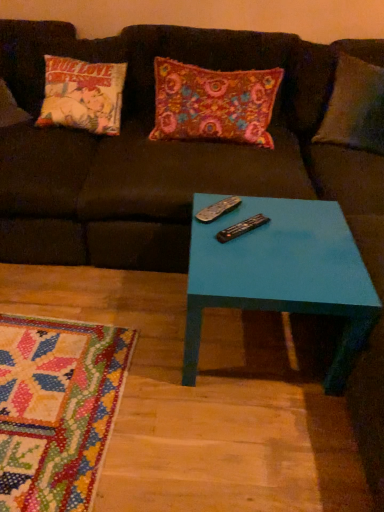
This screenshot has width=384, height=512. What do you see at coordinates (218, 209) in the screenshot?
I see `black plastic remote at center, arranged as the 1th remote when viewed from the back` at bounding box center [218, 209].

This screenshot has width=384, height=512. What are the coordinates of `teal glossy table at center` in the screenshot? It's located at (280, 273).

From a real-world perspective, is teal glossy table at center located beneath black plastic remote at center, which is counted as the 2th remote, starting from the front?

Correct, in the physical world, teal glossy table at center is lower than black plastic remote at center, which is counted as the 2th remote, starting from the front.

Between teal glossy table at center and black plastic remote at center, which is counted as the 2th remote, starting from the front, which one has smaller width?

Thinner between the two is black plastic remote at center, which is counted as the 2th remote, starting from the front.

Does point (279, 216) appear closer or farther from the camera than point (209, 221)?

Point (279, 216) is positioned farther from the camera compared to point (209, 221).

The width and height of the screenshot is (384, 512). In order to click on coffee table that appears below the black plastic remote at center, which is counted as the 2th remote, starting from the front (from a real-world perspective) in this screenshot , I will do tap(280, 273).

Is black plastic remote at center, which is the first remote in front-to-back order, to the right of teal glossy table at center from the viewer's perspective?

No, black plastic remote at center, which is the first remote in front-to-back order, is not to the right of teal glossy table at center.

Is black plastic remote at center, which is the first remote in front-to-back order, wider than teal glossy table at center?

No.

Considering the sizes of black plastic remote at center, the 2th remote in the back-to-front sequence, and teal glossy table at center in the image, is black plastic remote at center, the 2th remote in the back-to-front sequence, taller or shorter than teal glossy table at center?

In the image, black plastic remote at center, the 2th remote in the back-to-front sequence, appears to be shorter than teal glossy table at center.

How different are the orientations of black plastic remote at center, which is the first remote in front-to-back order, and teal glossy table at center in degrees?

There is a 51.2-degree angle between the facing directions of black plastic remote at center, which is the first remote in front-to-back order, and teal glossy table at center.

Between black plastic remote at center, arranged as the 1th remote when viewed from the back, and floral fabric pillow at center, which one is positioned in front?

black plastic remote at center, arranged as the 1th remote when viewed from the back, is closer to the camera.

Does black plastic remote at center, arranged as the 1th remote when viewed from the back, have a smaller size compared to floral fabric pillow at center?

Yes.

Is black plastic remote at center, arranged as the 1th remote when viewed from the back, positioned beyond the bounds of floral fabric pillow at center?

Yes, black plastic remote at center, arranged as the 1th remote when viewed from the back, is located beyond the bounds of floral fabric pillow at center.

From a real-world perspective, who is located lower, teal glossy table at center or floral fabric pillow at center?

teal glossy table at center, from a real-world perspective.

Image resolution: width=384 pixels, height=512 pixels. What are the coordinates of `pillow located on the left of teal glossy table at center` in the screenshot? It's located at (213, 103).

Is teal glossy table at center positioned with its back to floral fabric pillow at center?

Yes.

Can you confirm if teal glossy table at center is wider than floral fabric pillow at center?

Yes.

Is black plastic remote at center, the 2th remote in the back-to-front sequence, with black plastic remote at center, arranged as the 1th remote when viewed from the back?

No.

Would you say black plastic remote at center, the 2th remote in the back-to-front sequence, is outside black plastic remote at center, which is counted as the 2th remote, starting from the front?

Yes, black plastic remote at center, the 2th remote in the back-to-front sequence, is located beyond the bounds of black plastic remote at center, which is counted as the 2th remote, starting from the front.

Looking at the image, does black plastic remote at center, which is the first remote in front-to-back order, seem bigger or smaller compared to black plastic remote at center, which is counted as the 2th remote, starting from the front?

black plastic remote at center, which is the first remote in front-to-back order, is smaller than black plastic remote at center, which is counted as the 2th remote, starting from the front.

Does black plastic remote at center, which is the first remote in front-to-back order, come behind black plastic remote at center, arranged as the 1th remote when viewed from the back?

No, it is in front of black plastic remote at center, arranged as the 1th remote when viewed from the back.

Can you confirm if black plastic remote at center, which is counted as the 2th remote, starting from the front, is taller than black plastic remote at center, which is the first remote in front-to-back order?

Indeed, black plastic remote at center, which is counted as the 2th remote, starting from the front, has a greater height compared to black plastic remote at center, which is the first remote in front-to-back order.

Is black plastic remote at center, which is counted as the 2th remote, starting from the front, wider or thinner than black plastic remote at center, which is the first remote in front-to-back order?

Considering their sizes, black plastic remote at center, which is counted as the 2th remote, starting from the front, looks slimmer than black plastic remote at center, which is the first remote in front-to-back order.

What's the angular difference between black plastic remote at center, which is counted as the 2th remote, starting from the front, and black plastic remote at center, the 2th remote in the back-to-front sequence,'s facing directions?

black plastic remote at center, which is counted as the 2th remote, starting from the front, and black plastic remote at center, the 2th remote in the back-to-front sequence, are facing 3.07 degrees away from each other.

From the image's perspective, relative to black plastic remote at center, the 2th remote in the back-to-front sequence, is black plastic remote at center, arranged as the 1th remote when viewed from the back, above or below?

black plastic remote at center, arranged as the 1th remote when viewed from the back, is situated higher than black plastic remote at center, the 2th remote in the back-to-front sequence, in the image.

Could you measure the distance between black plastic remote at center, the 2th remote in the back-to-front sequence, and floral fabric pillow at center?

A distance of 29.52 inches exists between black plastic remote at center, the 2th remote in the back-to-front sequence, and floral fabric pillow at center.

Which object is wider, black plastic remote at center, the 2th remote in the back-to-front sequence, or floral fabric pillow at center?

With larger width is floral fabric pillow at center.

You are a GUI agent. You are given a task and a screenshot of the screen. Output one action in this format:
    pyautogui.click(x=<x>, y=<y>)
    Task: Click on the remote that is the 2nd object located below the floral fabric pillow at center (from the image's perspective)
    The image size is (384, 512).
    Given the screenshot: What is the action you would take?
    pyautogui.click(x=241, y=228)

From the image's perspective, is black plastic remote at center, the 2th remote in the back-to-front sequence, above floral fabric pillow at center?

No.

Locate an element on the screen. remote that is the 1st one above the teal glossy table at center (from a real-world perspective) is located at coordinates (218, 209).

Where is `coffee table located in front of the black plastic remote at center, which is the first remote in front-to-back order`? This screenshot has height=512, width=384. coffee table located in front of the black plastic remote at center, which is the first remote in front-to-back order is located at coordinates (280, 273).

Which object lies further to the anchor point teal glossy table at center, floral fabric pillow at center or black plastic remote at center, the 2th remote in the back-to-front sequence?

Among the two, floral fabric pillow at center is located further to teal glossy table at center.

From the image, which object appears to be farther from floral fabric pillow at center, black plastic remote at center, the 2th remote in the back-to-front sequence, or black plastic remote at center, arranged as the 1th remote when viewed from the back?

black plastic remote at center, the 2th remote in the back-to-front sequence, lies further to floral fabric pillow at center than the other object.

Looking at this image, estimate the real-world distances between objects in this image. Which object is further from teal glossy table at center, black plastic remote at center, which is counted as the 2th remote, starting from the front, or black plastic remote at center, the 2th remote in the back-to-front sequence?

black plastic remote at center, which is counted as the 2th remote, starting from the front, is further to teal glossy table at center.

Based on their spatial positions, is teal glossy table at center or black plastic remote at center, which is the first remote in front-to-back order, closer to floral fabric pillow at center?

Based on the image, teal glossy table at center appears to be nearer to floral fabric pillow at center.

Looking at this image, estimate the real-world distances between objects in this image. Which object is closer to teal glossy table at center, black plastic remote at center, which is the first remote in front-to-back order, or black plastic remote at center, arranged as the 1th remote when viewed from the back?

Among the two, black plastic remote at center, which is the first remote in front-to-back order, is located nearer to teal glossy table at center.

Considering their positions, is black plastic remote at center, the 2th remote in the back-to-front sequence, positioned further to black plastic remote at center, which is counted as the 2th remote, starting from the front, than teal glossy table at center?

Based on the image, teal glossy table at center appears to be further to black plastic remote at center, which is counted as the 2th remote, starting from the front.

Considering their positions, is black plastic remote at center, arranged as the 1th remote when viewed from the back, positioned further to teal glossy table at center than floral fabric pillow at center?

Based on the image, floral fabric pillow at center appears to be further to teal glossy table at center.

Considering their positions, is black plastic remote at center, arranged as the 1th remote when viewed from the back, positioned closer to floral fabric pillow at center than black plastic remote at center, which is the first remote in front-to-back order?

black plastic remote at center, arranged as the 1th remote when viewed from the back.

You are a GUI agent. You are given a task and a screenshot of the screen. Output one action in this format:
    pyautogui.click(x=<x>, y=<y>)
    Task: Click on the remote between black plastic remote at center, arranged as the 1th remote when viewed from the back, and teal glossy table at center, in the vertical direction
    
    Given the screenshot: What is the action you would take?
    pyautogui.click(x=241, y=228)

The height and width of the screenshot is (512, 384). Find the location of `remote between floral fabric pillow at center and black plastic remote at center, the 2th remote in the back-to-front sequence, vertically`. remote between floral fabric pillow at center and black plastic remote at center, the 2th remote in the back-to-front sequence, vertically is located at coordinates click(218, 209).